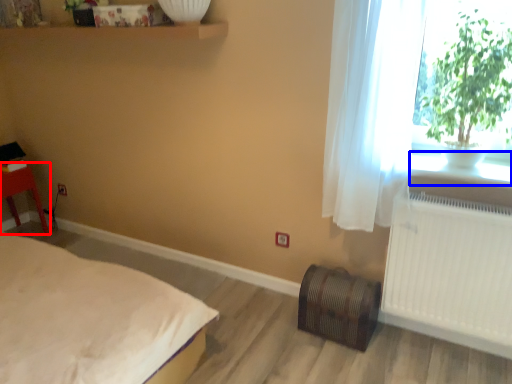
Question: Which point is closer to the camera, furniture (highlighted by a red box) or window sill (highlighted by a blue box)?

Choices:
 (A) furniture
 (B) window sill

Answer: (B)